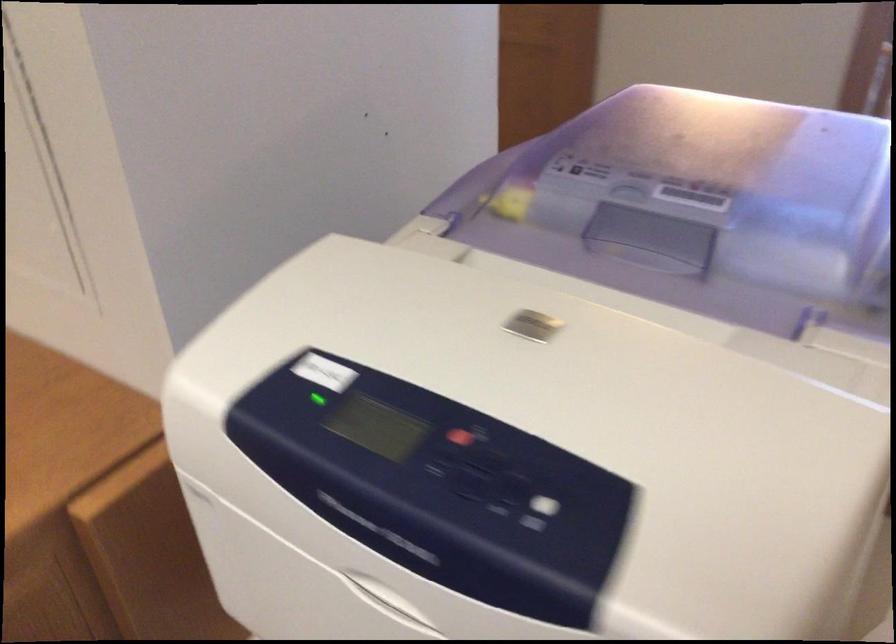
What do you see at coordinates (656, 234) in the screenshot? I see `the printer lid handle` at bounding box center [656, 234].